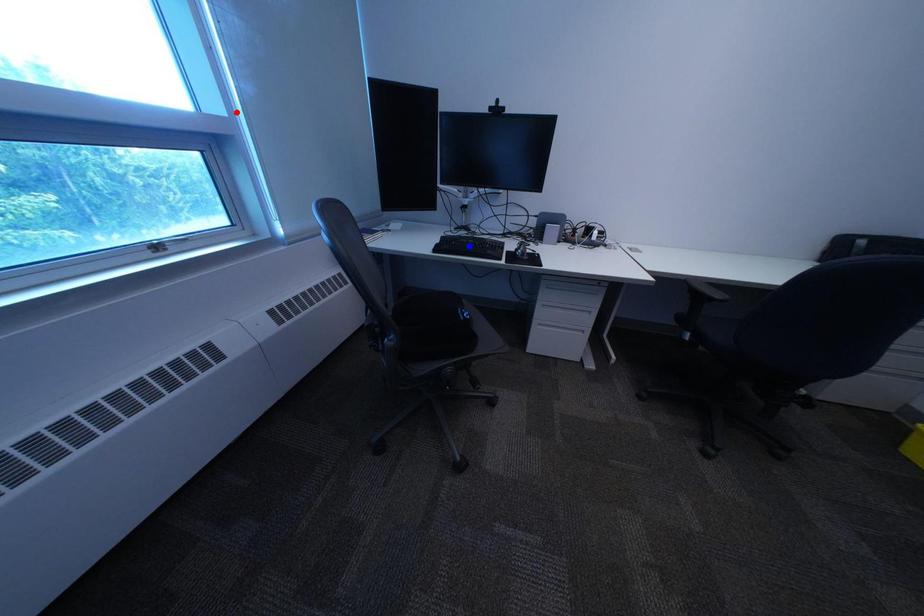
Question: Two points are marked on the image. Which point is closer to the camera?

Choices:
 (A) Blue point is closer.
 (B) Red point is closer.

Answer: (B)